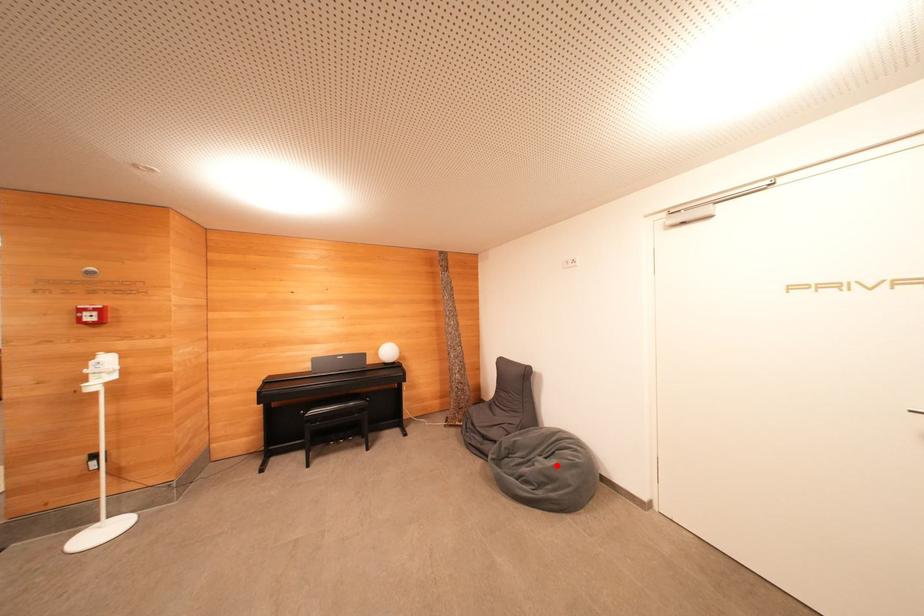
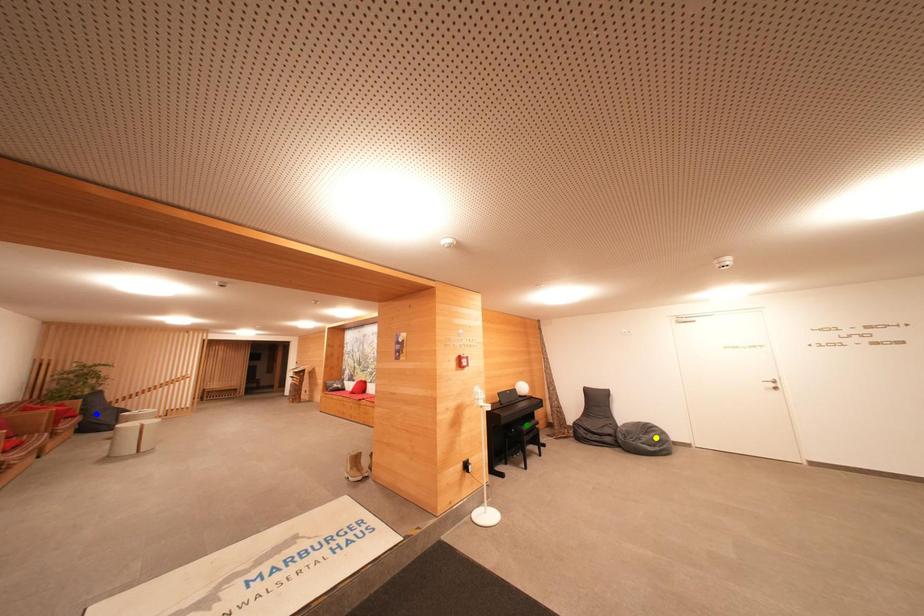
Question: I am providing you with two images of the same scene from different viewpoints. A red point is marked on the first image. You are given multiple points on the second image. Which point in image 2 is actually the same real-world point as the red point in image 1?

Choices:
 (A) yellow point
 (B) green point
 (C) blue point

Answer: (A)